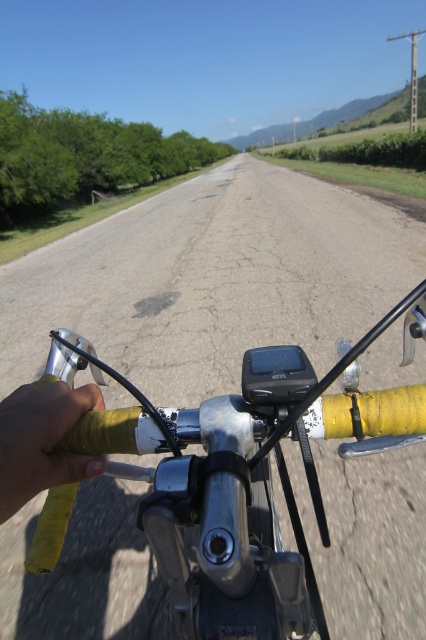
You are riding a bicycle and need to adjust your grip on the handlebars. Which object, the yellow matte handlebar at center or the yellow matte handlebar grip at lower left, is larger and thus provides more surface area for your hand?

The yellow matte handlebar at center is bigger than the yellow matte handlebar grip at lower left, so it provides more surface area for your hand.

You are riding a bicycle and looking at the road ahead. There are two points marked on the road ahead of you at coordinates point (242, 522) and point (48, 406). Which point is closer to you as you ride?

Point (242, 522) is closer to the viewer than point (48, 406).

You are riding a bicycle and need to adjust the GPS device mounted on the yellow matte handlebar at center. However, your left hand is currently holding the yellow matte handlebar grip at lower left. Can you reach the GPS device without letting go of the handlebar grip?

The yellow matte handlebar at center is further to the viewer than the yellow matte handlebar grip at lower left, meaning the GPS device is closer to you. Since your left hand is on the lower left grip, you might need to shift your grip or use your right hand to adjust the GPS device mounted on the closer handlebar.